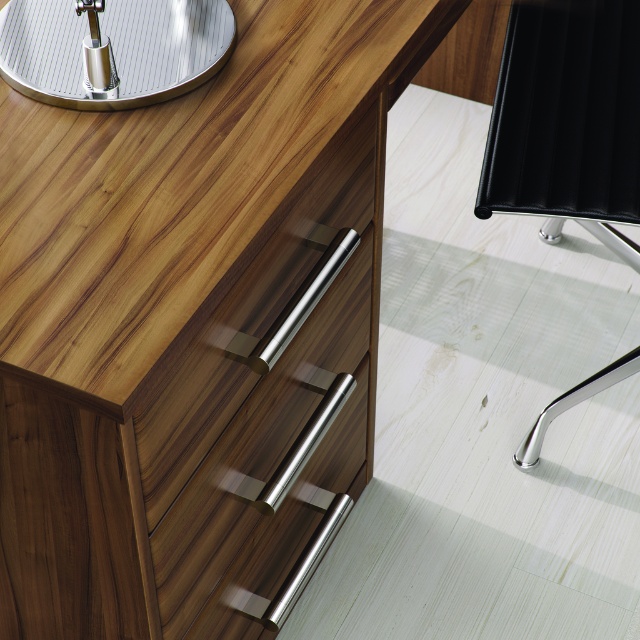
Question: Is wooden grain desk at upper left smaller than polished silver table at upper left?

Choices:
 (A) yes
 (B) no

Answer: (B)

Question: Which point is closer to the camera taking this photo?

Choices:
 (A) (116, 200)
 (B) (42, 51)

Answer: (A)

Question: Does wooden grain desk at upper left appear under polished silver table at upper left?

Choices:
 (A) yes
 (B) no

Answer: (A)

Question: Considering the real-world distances, which object is farthest from the wooden grain desk at upper left?

Choices:
 (A) black leather swivel chair at right
 (B) polished silver table at upper left

Answer: (A)

Question: Which point is farther to the camera?

Choices:
 (A) (26, 65)
 (B) (170, 227)
 (C) (577, 394)

Answer: (C)

Question: From the image, what is the correct spatial relationship of wooden grain desk at upper left in relation to polished silver table at upper left?

Choices:
 (A) above
 (B) below

Answer: (B)